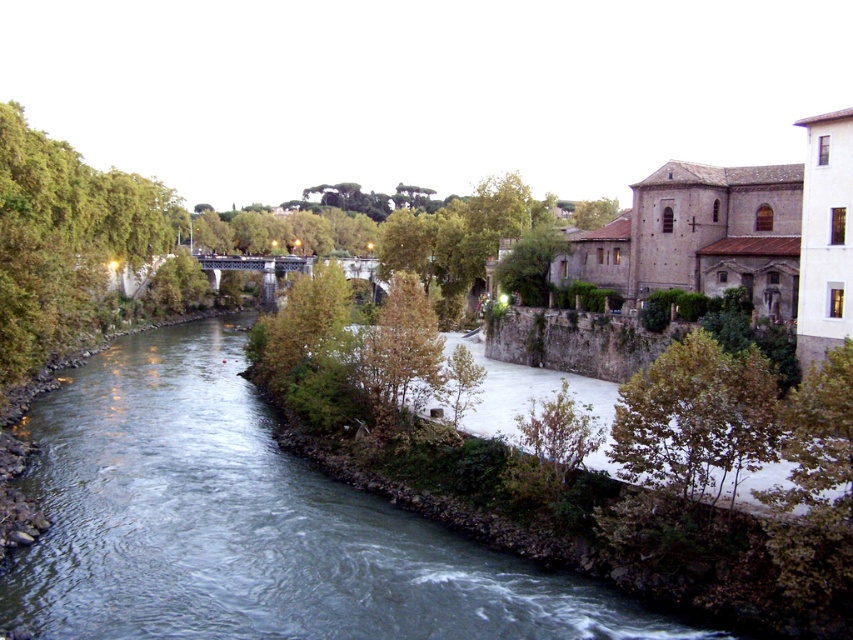
Does clear water at center have a greater width compared to green leafy tree at left?

Yes.

Does clear water at center appear under green leafy tree at left?

Indeed, clear water at center is positioned under green leafy tree at left.

Does point (51, 426) lie behind point (68, 308)?

No, it is not.

Find the location of a particular element. The image size is (853, 640). clear water at center is located at coordinates (250, 524).

Which of these two, green leafy tree at left or green matte tree at center, stands shorter?

With less height is green matte tree at center.

Is point (112, 195) positioned behind point (366, 356)?

That is True.

What do you see at coordinates (65, 240) in the screenshot? This screenshot has width=853, height=640. I see `green leafy tree at left` at bounding box center [65, 240].

In order to click on green leafy tree at left in this screenshot , I will do `click(65, 240)`.

Can you confirm if green leafy tree at left is positioned below green leafy tree at lower right?

Incorrect, green leafy tree at left is not positioned below green leafy tree at lower right.

Can you confirm if green leafy tree at left is wider than green leafy tree at lower right?

Yes, green leafy tree at left is wider than green leafy tree at lower right.

Identify the location of green leafy tree at left. The width and height of the screenshot is (853, 640). (x=65, y=240).